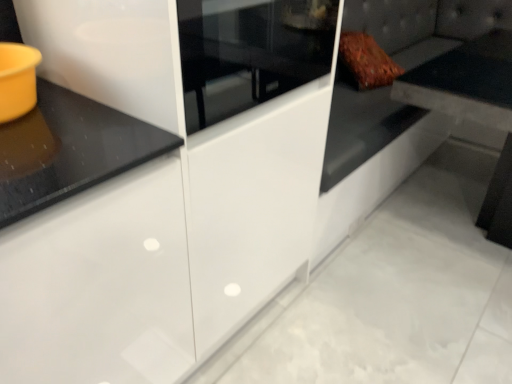
Question: Is leather couch at right taller or shorter than white glossy cabinet at center?

Choices:
 (A) short
 (B) tall

Answer: (A)

Question: Visually, is leather couch at right positioned to the left or to the right of white glossy cabinet at center?

Choices:
 (A) right
 (B) left

Answer: (A)

Question: Which of these objects is positioned closest to the leather couch at right?

Choices:
 (A) matte black table at upper right
 (B) white glossy cabinet at center

Answer: (B)

Question: Estimate the real-world distances between objects in this image. Which object is farther from the leather couch at right?

Choices:
 (A) matte black table at upper right
 (B) white glossy cabinet at center

Answer: (A)